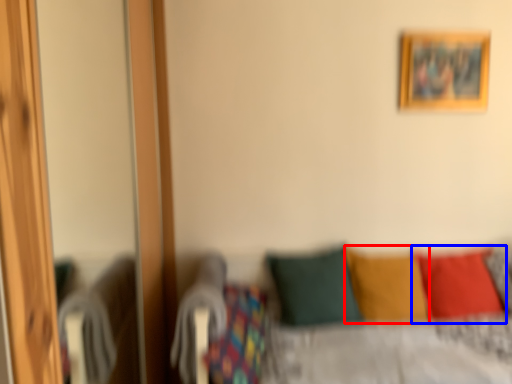
Question: Among these objects, which one is nearest to the camera, pillow (highlighted by a red box) or pillow (highlighted by a blue box)?

Choices:
 (A) pillow
 (B) pillow

Answer: (A)